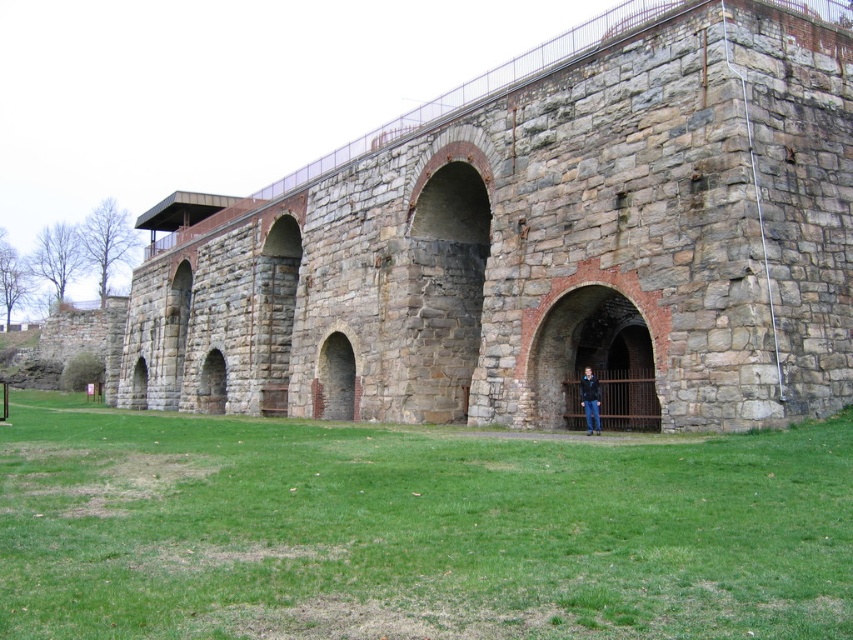
Does green grass at lower center have a lesser height compared to blue denim jacket at lower center?

In fact, green grass at lower center may be taller than blue denim jacket at lower center.

You are a GUI agent. You are given a task and a screenshot of the screen. Output one action in this format:
    pyautogui.click(x=<x>, y=<y>)
    Task: Click on the green grass at lower center
    
    Given the screenshot: What is the action you would take?
    pyautogui.click(x=415, y=531)

Locate an element on the screen. green grass at lower center is located at coordinates (415, 531).

Which is more to the right, stone brick viaduct at center or blue denim jacket at lower center?

blue denim jacket at lower center

Is stone brick viaduct at center below blue denim jacket at lower center?

Incorrect, stone brick viaduct at center is not positioned below blue denim jacket at lower center.

Measure the distance between point (456, 376) and camera.

Point (456, 376) and camera are 55.29 meters apart.

The width and height of the screenshot is (853, 640). I want to click on stone brick viaduct at center, so click(x=538, y=241).

Is stone brick viaduct at center further to camera compared to green grass at lower center?

Yes, it is.

Does stone brick viaduct at center have a smaller size compared to green grass at lower center?

No, stone brick viaduct at center is not smaller than green grass at lower center.

You are a GUI agent. You are given a task and a screenshot of the screen. Output one action in this format:
    pyautogui.click(x=<x>, y=<y>)
    Task: Click on the stone brick viaduct at center
    This screenshot has width=853, height=640.
    Given the screenshot: What is the action you would take?
    pyautogui.click(x=538, y=241)

Image resolution: width=853 pixels, height=640 pixels. What are the coordinates of `stone brick viaduct at center` in the screenshot? It's located at (538, 241).